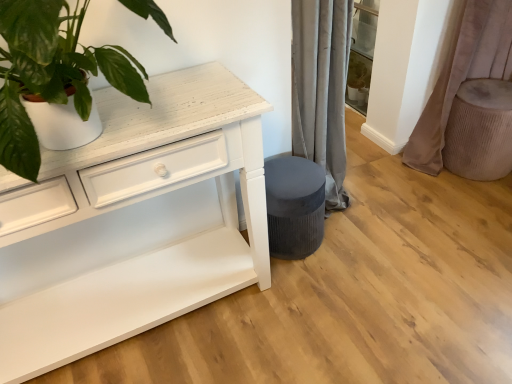
Question: From the image's perspective, is velvet beige curtain at right above or below white matte plant pot at upper left?

Choices:
 (A) below
 (B) above

Answer: (B)

Question: Relative to white matte plant pot at upper left, is velvet beige curtain at right in front or behind?

Choices:
 (A) front
 (B) behind

Answer: (B)

Question: Based on their relative distances, which object is nearer to the velvet dark gray stool at lower center?

Choices:
 (A) beige textured ottoman at right
 (B) white matte plant pot at upper left
 (C) velvet beige curtain at right

Answer: (B)

Question: Based on their relative distances, which object is farther from the velvet beige curtain at right?

Choices:
 (A) velvet dark gray stool at lower center
 (B) white matte plant pot at upper left
 (C) beige textured ottoman at right

Answer: (B)